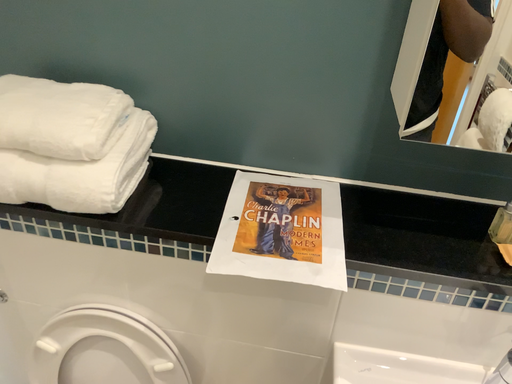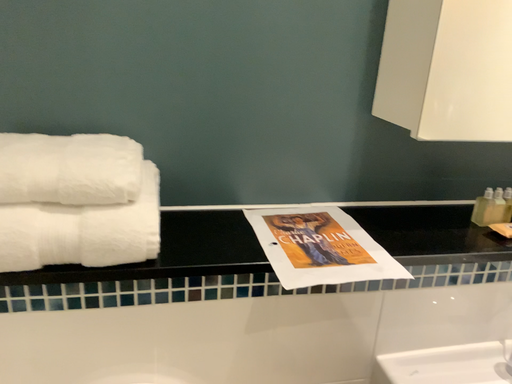
Question: How did the camera likely rotate when shooting the video?

Choices:
 (A) rotated upward
 (B) rotated downward

Answer: (A)